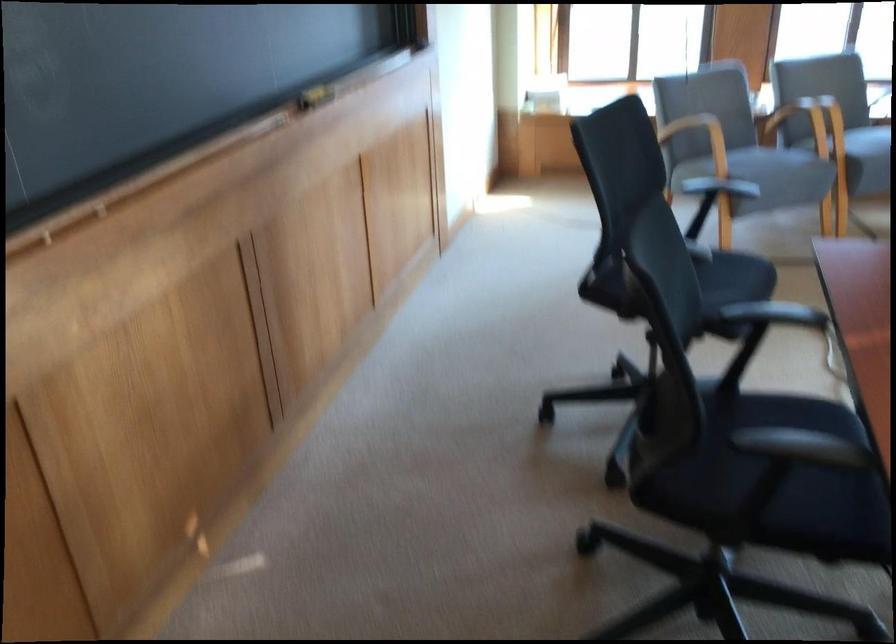
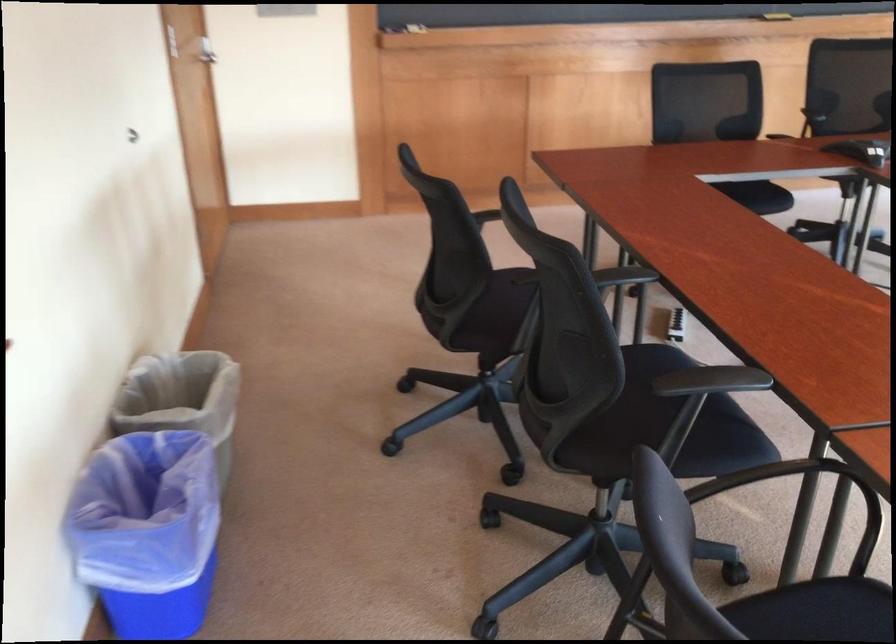
Question: I am providing you with two images of the same scene from different viewpoints. After the viewpoint changes to image2, which objects are now occluded?

Choices:
 (A) black chair armrest
 (B) grey trash can
 (C) blue trash can
 (D) tabletop sign holder

Answer: (A)